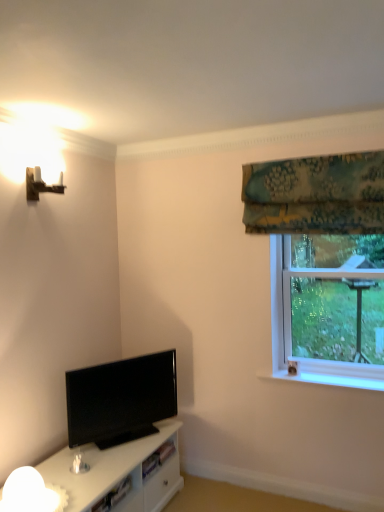
Question: Is black glossy tv at lower left wider or thinner than transparent glass window at upper right?

Choices:
 (A) thin
 (B) wide

Answer: (A)

Question: From the image's perspective, is black glossy tv at lower left positioned above or below transparent glass window at upper right?

Choices:
 (A) below
 (B) above

Answer: (A)

Question: Which object is the farthest from the wooden wall sconce at upper left?

Choices:
 (A) green floral fabric at upper right
 (B) black glossy tv at lower left
 (C) white frosted glass lamp at lower left
 (D) transparent glass window at upper right

Answer: (D)

Question: Which is farther from the transparent glass window at upper right?

Choices:
 (A) green floral fabric at upper right
 (B) wooden wall sconce at upper left
 (C) black glossy tv at lower left
 (D) white frosted glass lamp at lower left

Answer: (B)